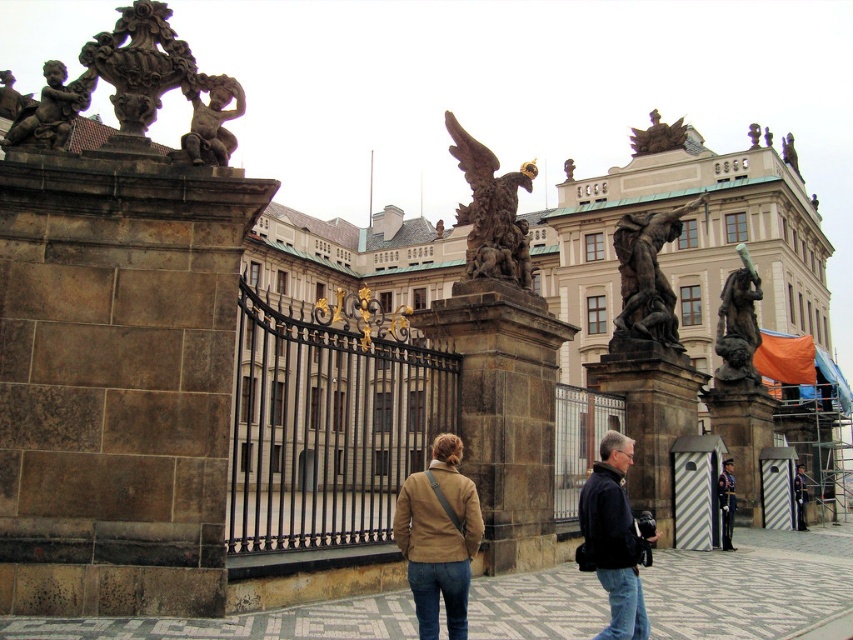
You are an art student visiting this historic site. You want to sketch both the polished stone eagle at center and the bronze statue at right. Based on their sizes, which one should you focus on first to ensure you capture their details accurately?

The polished stone eagle at center is larger than the bronze statue at right, so you should focus on sketching the polished stone eagle at center first to ensure you can capture its details accurately.